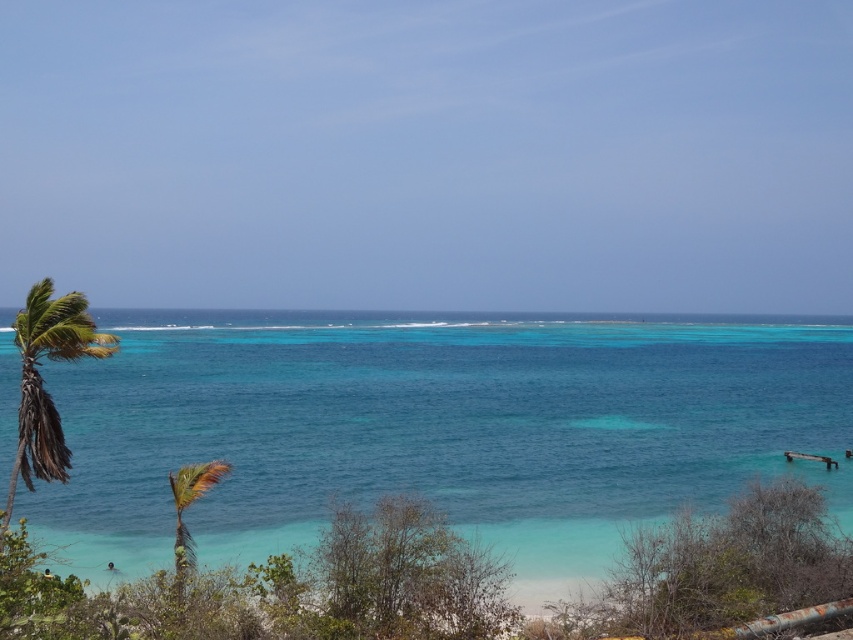
Question: Estimate the real-world distances between objects in this image. Which object is closer to the clear blue water at center?

Choices:
 (A) green leafy palm tree at left
 (B) green leafy shrubs at lower center
 (C) green leafy palm tree at lower left

Answer: (B)

Question: Which point is closer to the camera?

Choices:
 (A) (91, 348)
 (B) (192, 470)
 (C) (560, 470)
 (D) (142, 598)

Answer: (D)

Question: Is green leafy shrubs at lower center wider than green leafy palm tree at lower left?

Choices:
 (A) yes
 (B) no

Answer: (A)

Question: Which object appears closest to the camera in this image?

Choices:
 (A) green leafy palm tree at lower left
 (B) clear blue water at center

Answer: (A)

Question: Is clear blue water at center below green leafy palm tree at lower left?

Choices:
 (A) yes
 (B) no

Answer: (B)

Question: Is green leafy shrubs at lower center to the right of green leafy palm tree at lower left from the viewer's perspective?

Choices:
 (A) no
 (B) yes

Answer: (B)